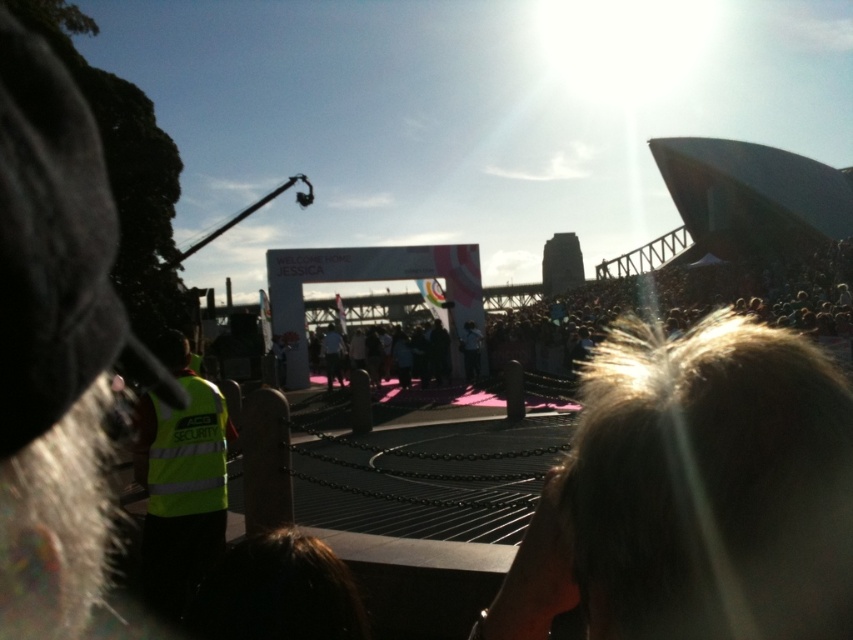
Question: Does neon yellow reflective vest at lower left have a smaller size compared to pink fabric crowd at center?

Choices:
 (A) yes
 (B) no

Answer: (A)

Question: Is neon yellow reflective vest at lower left thinner than pink fabric crowd at center?

Choices:
 (A) no
 (B) yes

Answer: (B)

Question: Which object is farther from the camera taking this photo?

Choices:
 (A) neon yellow reflective vest at lower left
 (B) pink fabric crowd at center

Answer: (B)

Question: Does neon yellow reflective vest at lower left have a larger size compared to pink fabric crowd at center?

Choices:
 (A) yes
 (B) no

Answer: (B)

Question: Which object is closer to the camera taking this photo?

Choices:
 (A) pink fabric crowd at center
 (B) neon yellow reflective vest at lower left

Answer: (B)